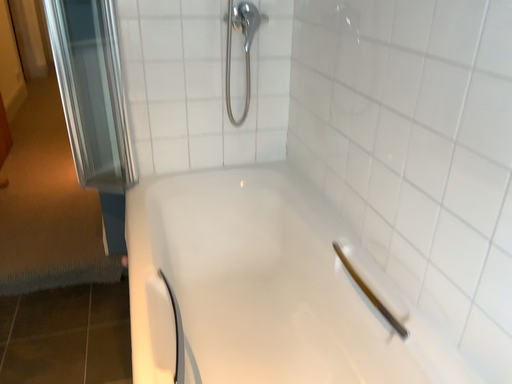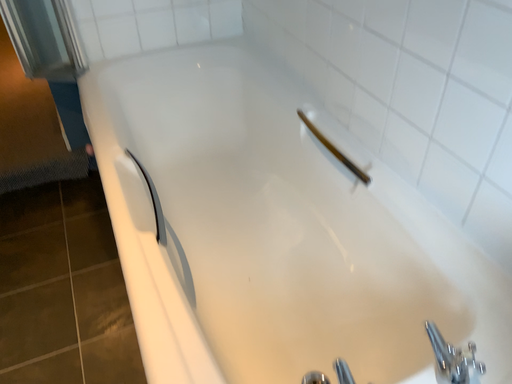
Question: How did the camera likely rotate when shooting the video?

Choices:
 (A) rotated downward
 (B) rotated upward

Answer: (A)